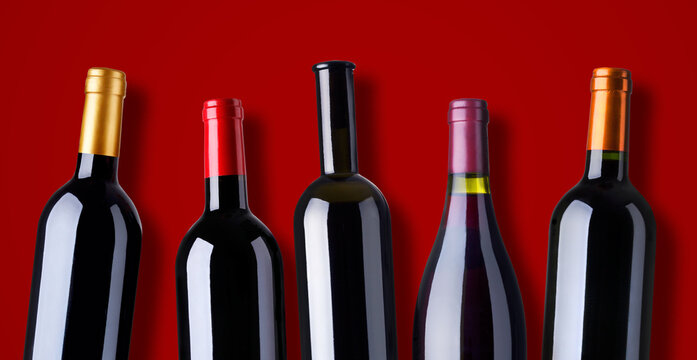
The height and width of the screenshot is (360, 697). Find the location of `wine bottles`. wine bottles is located at coordinates pyautogui.click(x=595, y=272), pyautogui.click(x=461, y=272), pyautogui.click(x=344, y=270), pyautogui.click(x=237, y=275), pyautogui.click(x=79, y=266).